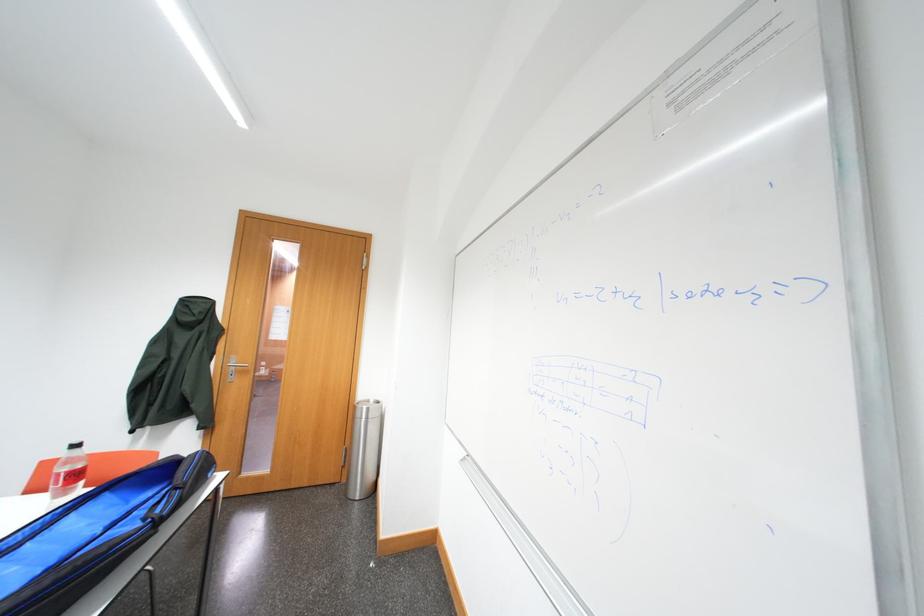
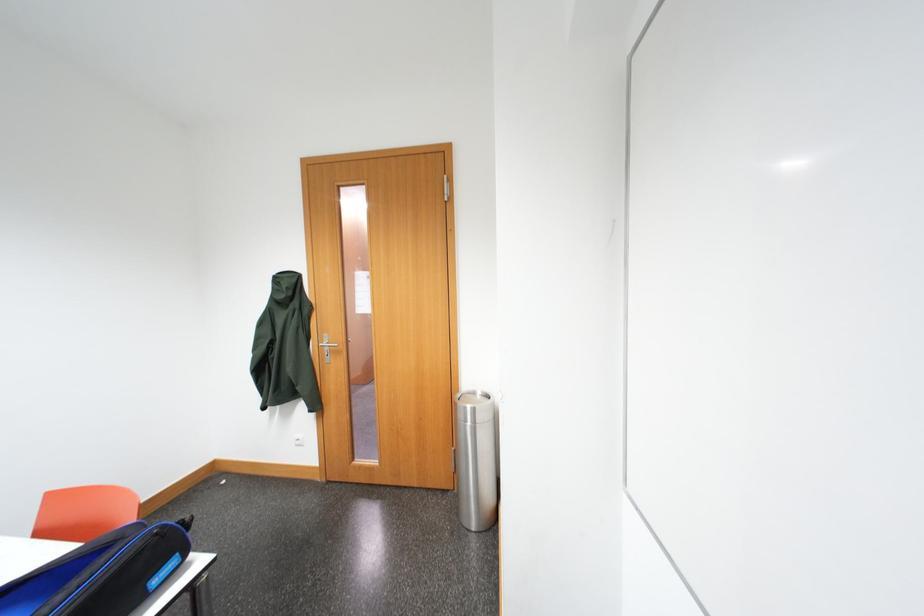
Question: Which direction would the cameraman need to move to produce the second image? Reply with the corresponding letter.

Choices:
 (A) Left
 (B) Right
 (C) Forward
 (D) Backward

Answer: (C)